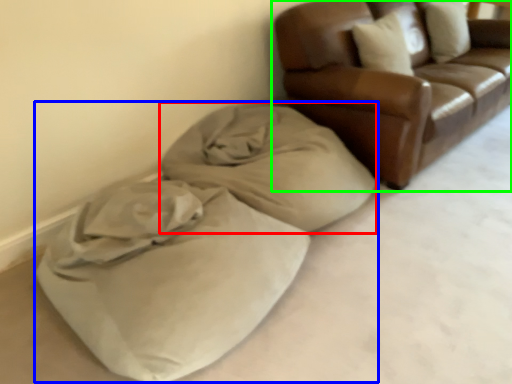
Question: Estimate the real-world distances between objects in this image. Which object is farther from blanket (highlighted by a red box), bean bag chair (highlighted by a blue box) or studio couch (highlighted by a green box)?

Choices:
 (A) bean bag chair
 (B) studio couch

Answer: (B)